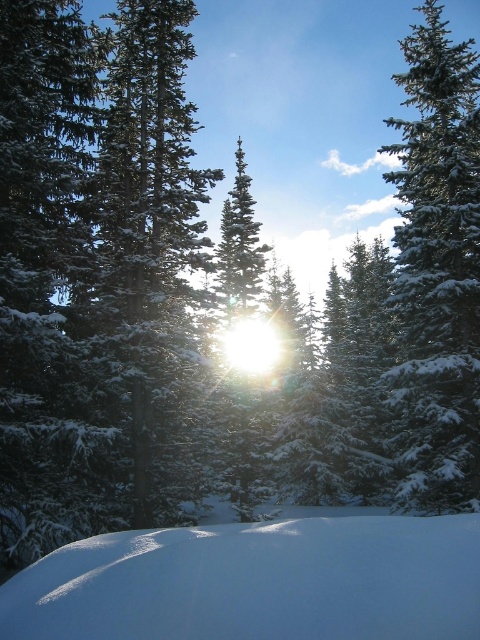
Is point (80, 572) farther from camera compared to point (176, 76)?

No, (80, 572) is closer to viewer.

This screenshot has height=640, width=480. Find the location of `white fluffy snow at lower center`. white fluffy snow at lower center is located at coordinates (256, 582).

Locate an element on the screen. Image resolution: width=480 pixels, height=640 pixels. white fluffy snow at lower center is located at coordinates (256, 582).

Locate an element on the screen. This screenshot has width=480, height=640. white fluffy snow at lower center is located at coordinates (256, 582).

Who is lower down, white fluffy snow at lower center or green snow-covered tree at right?

white fluffy snow at lower center is below.

Who is positioned more to the right, white fluffy snow at lower center or green snow-covered tree at right?

From the viewer's perspective, green snow-covered tree at right appears more on the right side.

You are a GUI agent. You are given a task and a screenshot of the screen. Output one action in this format:
    pyautogui.click(x=<x>, y=<y>)
    Task: Click on the white fluffy snow at lower center
    This screenshot has width=480, height=640.
    Given the screenshot: What is the action you would take?
    pyautogui.click(x=256, y=582)

Consider the image. Is green matte tree at center wider than green snow-covered tree at right?

No.

Is point (163, 4) less distant than point (416, 296)?

No, (163, 4) is further to viewer.

Who is more distant from viewer, (183, 468) or (445, 218)?

Point (183, 468)

Where is `green matte tree at center`? green matte tree at center is located at coordinates (149, 237).